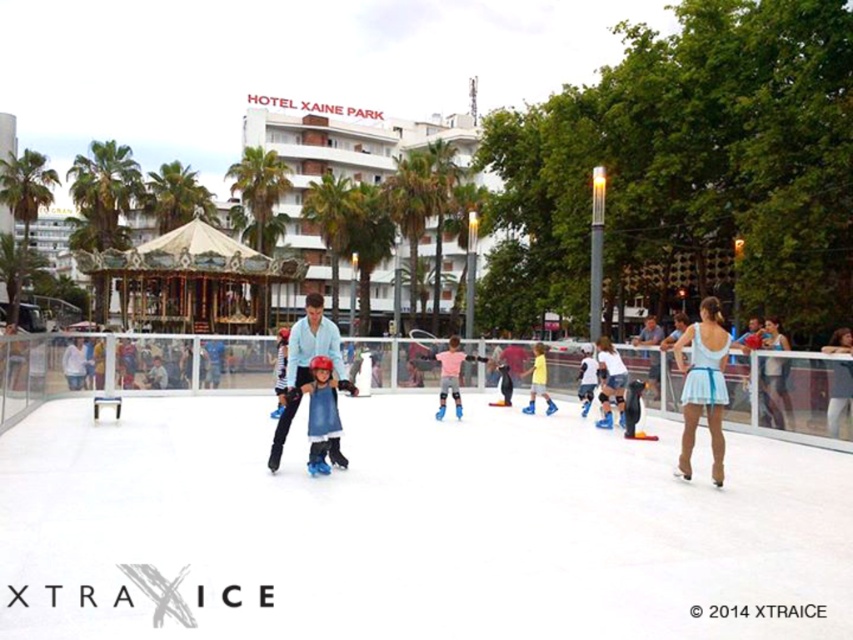
Question: Which point is closer to the camera?

Choices:
 (A) green leafy palm tree at center
 (B) light blue satin dress at center
 (C) light blue fabric dress at center
 (D) green leafy palm tree at upper left

Answer: (B)

Question: Is blue matte ice skates at center below yellow matte skates at center?

Choices:
 (A) yes
 (B) no

Answer: (A)

Question: Does blue matte ice skates at center lie behind pink matte ice skates at center?

Choices:
 (A) yes
 (B) no

Answer: (B)

Question: Is green leafy palm tree at upper left to the left of blue fabric dress at center from the viewer's perspective?

Choices:
 (A) yes
 (B) no

Answer: (A)

Question: Among these points, which one is farthest from the camera?

Choices:
 (A) coord(35,573)
 (B) coord(532,404)
 (C) coord(614,392)

Answer: (B)

Question: Which point is closer to the camera?

Choices:
 (A) green leafy palm tree at center
 (B) light blue fabric dress at center
 (C) blue fabric dress at center
 (D) light blue satin dress at center

Answer: (D)